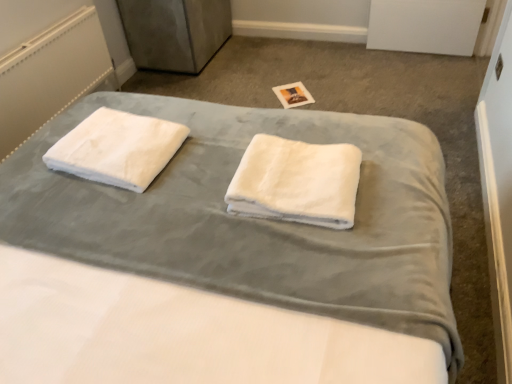
In order to click on white soft towel at left, which is the 2th towel from right to left in this screenshot , I will do `click(117, 148)`.

The image size is (512, 384). Describe the element at coordinates (255, 222) in the screenshot. I see `white soft towels at center` at that location.

Where is `white fabric radiator at upper left`? white fabric radiator at upper left is located at coordinates (50, 74).

Based on the photo, is white fabric radiator at upper left smaller than white fluffy towel at center, marked as the 1th towel in a right-to-left arrangement?

Actually, white fabric radiator at upper left might be larger than white fluffy towel at center, marked as the 1th towel in a right-to-left arrangement.

Consider the image. From the image's perspective, is white fabric radiator at upper left on white fluffy towel at center, the 2th towel positioned from the left?

Yes.

Which object is further away from the camera, white fabric radiator at upper left or white fluffy towel at center, the 2th towel positioned from the left?

Positioned behind is white fabric radiator at upper left.

Does white fabric radiator at upper left have a lesser height compared to white fluffy towel at center, the 2th towel positioned from the left?

No.

Is white soft towel at left, which is the 2th towel from right to left, next to white soft towels at center and touching it?

They are not placed beside each other.

From the image's perspective, does white soft towel at left, the 1th towel viewed from the left, appear lower than white soft towels at center?

No, from the image's perspective, white soft towel at left, the 1th towel viewed from the left, is not beneath white soft towels at center.

Considering the relative sizes of white soft towel at left, which is the 2th towel from right to left, and white soft towels at center in the image provided, is white soft towel at left, which is the 2th towel from right to left, taller than white soft towels at center?

No, white soft towel at left, which is the 2th towel from right to left, is not taller than white soft towels at center.

What's the angular difference between white fluffy towel at center, marked as the 1th towel in a right-to-left arrangement, and white soft towel at left, which is the 2th towel from right to left,'s facing directions?

The angular difference between white fluffy towel at center, marked as the 1th towel in a right-to-left arrangement, and white soft towel at left, which is the 2th towel from right to left, is 5.52 degrees.

Does white fluffy towel at center, the 2th towel positioned from the left, have a greater height compared to white soft towel at left, which is the 2th towel from right to left?

Yes.

From the image's perspective, which is above, white fluffy towel at center, marked as the 1th towel in a right-to-left arrangement, or white soft towel at left, which is the 2th towel from right to left?

white soft towel at left, which is the 2th towel from right to left.

Is white fluffy towel at center, marked as the 1th towel in a right-to-left arrangement, turned away from white soft towel at left, the 1th towel viewed from the left?

No.

Which point is more distant from viewer, (76, 149) or (300, 204)?

The point (76, 149) is farther from the camera.

Is white soft towel at left, which is the 2th towel from right to left, situated inside white fluffy towel at center, the 2th towel positioned from the left, or outside?

The correct answer is: outside.

Is white soft towel at left, the 1th towel viewed from the left, aimed at white fluffy towel at center, marked as the 1th towel in a right-to-left arrangement?

No, white soft towel at left, the 1th towel viewed from the left, is not oriented towards white fluffy towel at center, marked as the 1th towel in a right-to-left arrangement.

In the image, is white soft towel at left, the 1th towel viewed from the left, positioned in front of or behind white fluffy towel at center, marked as the 1th towel in a right-to-left arrangement?

white soft towel at left, the 1th towel viewed from the left, is positioned farther from the viewer than white fluffy towel at center, marked as the 1th towel in a right-to-left arrangement.

Is white soft towels at center not inside white fluffy towel at center, the 2th towel positioned from the left?

Yes.

Considering the points (56, 238) and (333, 188), which point is behind, point (56, 238) or point (333, 188)?

The point (56, 238) is farther.

Is white soft towels at center behind white fluffy towel at center, marked as the 1th towel in a right-to-left arrangement?

No, the depth of white soft towels at center is less than that of white fluffy towel at center, marked as the 1th towel in a right-to-left arrangement.

From the image's perspective, is white soft towels at center located above white fluffy towel at center, the 2th towel positioned from the left?

Yes, from the image's perspective, white soft towels at center is over white fluffy towel at center, the 2th towel positioned from the left.

Is white fabric radiator at upper left at the right side of white soft towel at left, which is the 2th towel from right to left?

→ No, white fabric radiator at upper left is not to the right of white soft towel at left, which is the 2th towel from right to left.

Does point (61, 50) lie behind point (77, 154)?

Yes, it is behind point (77, 154).

From the image's perspective, which one is positioned higher, white fabric radiator at upper left or white soft towel at left, which is the 2th towel from right to left?

white fabric radiator at upper left appears higher in the image.

Consider the image. Can you confirm if white fabric radiator at upper left is smaller than white soft towel at left, which is the 2th towel from right to left?

No, white fabric radiator at upper left is not smaller than white soft towel at left, which is the 2th towel from right to left.

Between point (315, 191) and point (11, 133), which one is positioned behind?

Point (11, 133)

Does white fluffy towel at center, marked as the 1th towel in a right-to-left arrangement, touch white fabric radiator at upper left?

No.

Can you confirm if white fluffy towel at center, the 2th towel positioned from the left, is positioned to the right of white fabric radiator at upper left?

Yes, white fluffy towel at center, the 2th towel positioned from the left, is to the right of white fabric radiator at upper left.

Find the location of a particular element. radiator located behind the white fluffy towel at center, marked as the 1th towel in a right-to-left arrangement is located at coordinates (50, 74).

The width and height of the screenshot is (512, 384). Identify the location of bed in front of the white soft towel at left, the 1th towel viewed from the left. (255, 222).

When comparing their distances from white soft towels at center, does white fluffy towel at center, the 2th towel positioned from the left, or white soft towel at left, which is the 2th towel from right to left, seem closer?

white fluffy towel at center, the 2th towel positioned from the left, is closer to white soft towels at center.

Estimate the real-world distances between objects in this image. Which object is further from white fluffy towel at center, marked as the 1th towel in a right-to-left arrangement, white soft towels at center or white soft towel at left, the 1th towel viewed from the left?

white soft towel at left, the 1th towel viewed from the left.

Which object lies further to the anchor point white fabric radiator at upper left, white fluffy towel at center, marked as the 1th towel in a right-to-left arrangement, or white soft towels at center?

white fluffy towel at center, marked as the 1th towel in a right-to-left arrangement.

From the picture: Looking at the image, which one is located closer to white soft towels at center, white fabric radiator at upper left or white soft towel at left, which is the 2th towel from right to left?

Based on the image, white soft towel at left, which is the 2th towel from right to left, appears to be nearer to white soft towels at center.

In the scene shown: Based on their spatial positions, is white soft towel at left, the 1th towel viewed from the left, or white fluffy towel at center, the 2th towel positioned from the left, closer to white fabric radiator at upper left?

white soft towel at left, the 1th towel viewed from the left, is closer to white fabric radiator at upper left.

Which object lies nearer to the anchor point white fluffy towel at center, marked as the 1th towel in a right-to-left arrangement, white soft towel at left, which is the 2th towel from right to left, or white fabric radiator at upper left?

The object closer to white fluffy towel at center, marked as the 1th towel in a right-to-left arrangement, is white soft towel at left, which is the 2th towel from right to left.

When comparing their distances from white soft towels at center, does white soft towel at left, which is the 2th towel from right to left, or white fabric radiator at upper left seem further?

white fabric radiator at upper left.

Looking at the image, which one is located further to white fabric radiator at upper left, white soft towels at center or white soft towel at left, which is the 2th towel from right to left?

white soft towels at center.

Where is `towel located between white soft towels at center and white soft towel at left, the 1th towel viewed from the left, in the depth direction`? towel located between white soft towels at center and white soft towel at left, the 1th towel viewed from the left, in the depth direction is located at coordinates (296, 182).

Locate an element on the screen. This screenshot has width=512, height=384. towel between white fabric radiator at upper left and white fluffy towel at center, the 2th towel positioned from the left, in the horizontal direction is located at coordinates (117, 148).